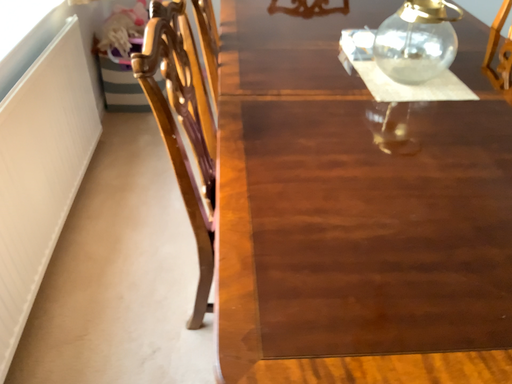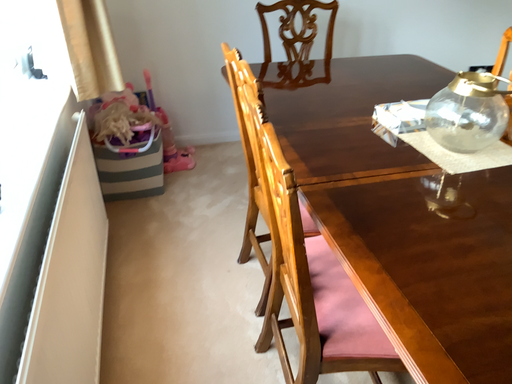
Question: How did the camera likely rotate when shooting the video?

Choices:
 (A) rotated downward
 (B) rotated upward

Answer: (B)